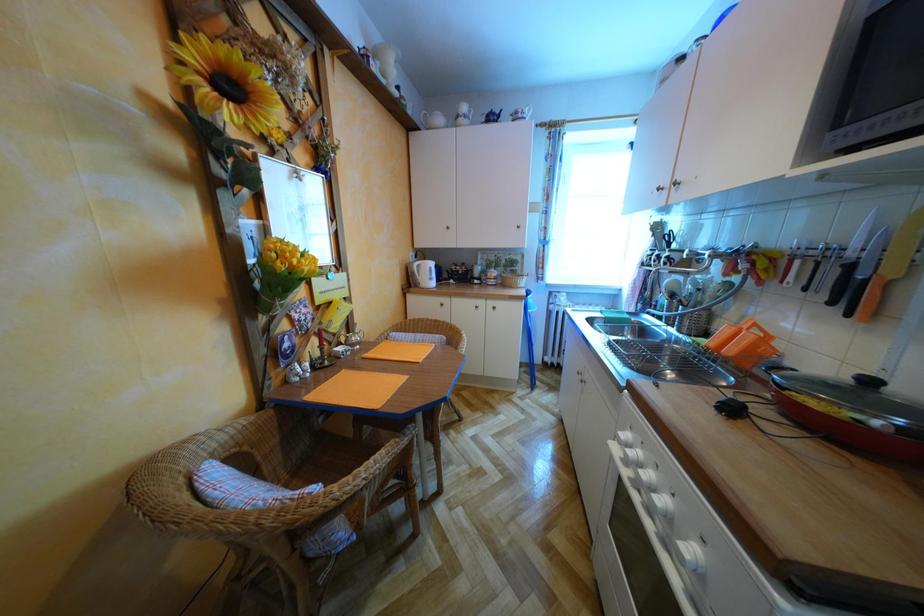
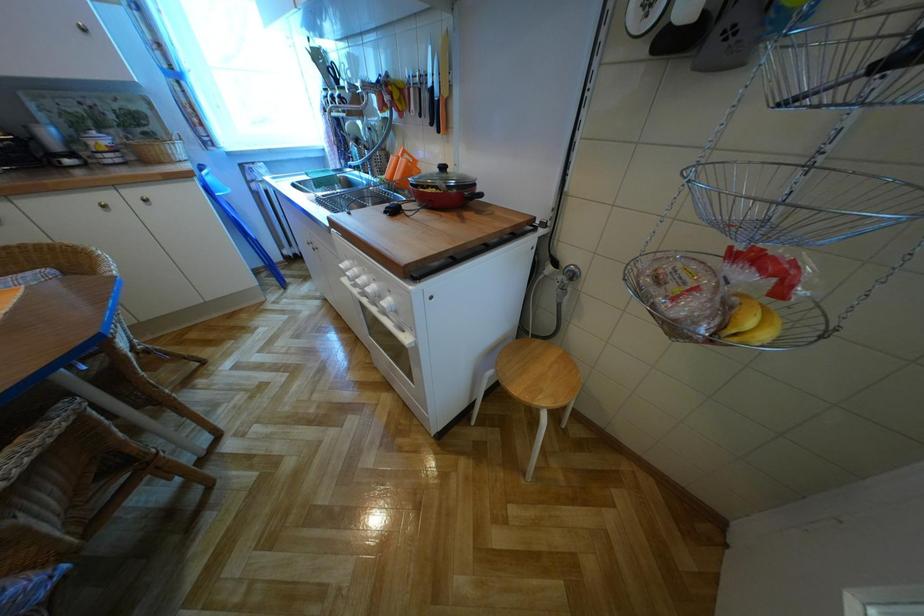
First-person continuous shooting, in which direction is the camera rotating?

The camera's rotation is toward right-down.